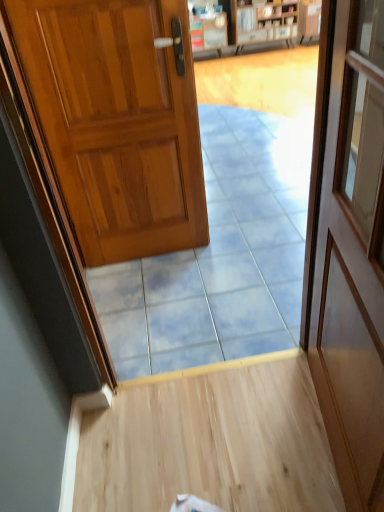
In order to face wooden door at right, which appears as the first door when viewed from the right, should I rotate leftwards or rightwards?

To face it directly, rotate right by 17.883 degrees.

The image size is (384, 512). Describe the element at coordinates (117, 121) in the screenshot. I see `shiny wood door at left, which is the second door in front-to-back order` at that location.

At what (x,y) coordinates should I click in order to perform the action: click on wooden bookshelf at upper center. Please return your answer as a coordinate pair (x, y). Looking at the image, I should click on (252, 25).

Locate an element on the screen. The width and height of the screenshot is (384, 512). blue glossy tile at center is located at coordinates (179, 324).

Which object is closer to the camera, shiny wood door at left, the first door viewed from the left, or wooden bookshelf at upper center?

shiny wood door at left, the first door viewed from the left, is closer to the camera.

From a real-world perspective, which object rests below the other?

wooden bookshelf at upper center, from a real-world perspective.

Considering the positions of objects shiny wood door at left, the first door viewed from the left, and wooden bookshelf at upper center in the image provided, who is more to the right, shiny wood door at left, the first door viewed from the left, or wooden bookshelf at upper center?

wooden bookshelf at upper center is more to the right.

Between shiny wood door at left, the first door viewed from the left, and wooden bookshelf at upper center, which one has larger width?

shiny wood door at left, the first door viewed from the left, is wider.

Is wooden door at right, marked as the 2th door in a back-to-front arrangement, taller than wooden bookshelf at upper center?

Correct, wooden door at right, marked as the 2th door in a back-to-front arrangement, is much taller as wooden bookshelf at upper center.

Considering the sizes of objects wooden door at right, the 2th door viewed from the left, and wooden bookshelf at upper center in the image provided, who is bigger, wooden door at right, the 2th door viewed from the left, or wooden bookshelf at upper center?

wooden bookshelf at upper center is bigger.

Is wooden bookshelf at upper center at the back of wooden door at right, marked as the 2th door in a back-to-front arrangement?

wooden door at right, marked as the 2th door in a back-to-front arrangement, is not turned away from wooden bookshelf at upper center.

Can you confirm if wooden door at right, the 1th door positioned from the front, is positioned to the right of wooden bookshelf at upper center?

Incorrect, wooden door at right, the 1th door positioned from the front, is not on the right side of wooden bookshelf at upper center.

From the image's perspective, between wooden door at right, marked as the 2th door in a back-to-front arrangement, and shiny wood door at left, positioned as the second door in right-to-left order, which one is located above?

From the image's view, shiny wood door at left, positioned as the second door in right-to-left order, is above.

Could you tell me if wooden door at right, the 1th door positioned from the front, is turned towards shiny wood door at left, which is the second door in front-to-back order?

No, wooden door at right, the 1th door positioned from the front, does not turn towards shiny wood door at left, which is the second door in front-to-back order.

Which object is closer to the camera taking this photo, wooden door at right, the 2th door viewed from the left, or shiny wood door at left, which is the second door in front-to-back order?

wooden door at right, the 2th door viewed from the left.

Is blue glossy tile at center surrounding shiny wood door at left, which is the second door in front-to-back order?

No, shiny wood door at left, which is the second door in front-to-back order, is located outside of blue glossy tile at center.

You are a GUI agent. You are given a task and a screenshot of the screen. Output one action in this format:
    pyautogui.click(x=<x>, y=<y>)
    Task: Click on the tile below the shiny wood door at left, the first door viewed from the left (from a real-world perspective)
    The height and width of the screenshot is (512, 384).
    Given the screenshot: What is the action you would take?
    pyautogui.click(x=179, y=324)

In the scene shown: Is blue glossy tile at center bigger or smaller than shiny wood door at left, positioned as the 1th door in back-to-front order?

In the image, blue glossy tile at center appears to be smaller than shiny wood door at left, positioned as the 1th door in back-to-front order.

Would you say wooden bookshelf at upper center is outside shiny wood door at left, positioned as the second door in right-to-left order?

Yes, wooden bookshelf at upper center is located beyond the bounds of shiny wood door at left, positioned as the second door in right-to-left order.

Does point (286, 34) come farther from viewer compared to point (102, 81)?

Yes, it is behind point (102, 81).

Considering the sizes of objects wooden bookshelf at upper center and shiny wood door at left, positioned as the second door in right-to-left order, in the image provided, who is wider, wooden bookshelf at upper center or shiny wood door at left, positioned as the second door in right-to-left order,?

With larger width is shiny wood door at left, positioned as the second door in right-to-left order.

Is wooden bookshelf at upper center to the right of shiny wood door at left, positioned as the second door in right-to-left order, from the viewer's perspective?

Yes, wooden bookshelf at upper center is to the right of shiny wood door at left, positioned as the second door in right-to-left order.

Can you tell me how much blue glossy tile at center and wooden bookshelf at upper center differ in facing direction?

The angular difference between blue glossy tile at center and wooden bookshelf at upper center is 3.7 degrees.

Is point (162, 341) positioned before point (194, 42)?

Yes, it is in front of point (194, 42).

Is blue glossy tile at center not inside wooden bookshelf at upper center?

Absolutely, blue glossy tile at center is external to wooden bookshelf at upper center.

Is the position of blue glossy tile at center more distant than that of wooden bookshelf at upper center?

No, the depth of blue glossy tile at center is less than that of wooden bookshelf at upper center.

Is wooden bookshelf at upper center shorter than wooden door at right, marked as the 2th door in a back-to-front arrangement?

Indeed, wooden bookshelf at upper center has a lesser height compared to wooden door at right, marked as the 2th door in a back-to-front arrangement.

Does wooden bookshelf at upper center have a lesser width compared to wooden door at right, the 2th door viewed from the left?

Incorrect, the width of wooden bookshelf at upper center is not less than that of wooden door at right, the 2th door viewed from the left.

Consider the image. Does wooden bookshelf at upper center lie behind wooden door at right, which appears as the first door when viewed from the right?

Yes, the depth of wooden bookshelf at upper center is greater than that of wooden door at right, which appears as the first door when viewed from the right.

Is wooden bookshelf at upper center smaller than wooden door at right, the 1th door positioned from the front?

Actually, wooden bookshelf at upper center might be larger than wooden door at right, the 1th door positioned from the front.

The width and height of the screenshot is (384, 512). Identify the location of bookshelf above the shiny wood door at left, which is the second door in front-to-back order (from the image's perspective). (252, 25).

Which door is the 2nd one when counting from the front of the wooden bookshelf at upper center? Please provide its 2D coordinates.

[(349, 250)]

Based on their spatial positions, is blue glossy tile at center or shiny wood door at left, positioned as the second door in right-to-left order, further from wooden bookshelf at upper center?

blue glossy tile at center is further to wooden bookshelf at upper center.

Looking at the image, which one is located further to shiny wood door at left, the first door viewed from the left, wooden door at right, the 1th door positioned from the front, or wooden bookshelf at upper center?

wooden bookshelf at upper center is further to shiny wood door at left, the first door viewed from the left.

From the image, which object appears to be farther from blue glossy tile at center, shiny wood door at left, which is the second door in front-to-back order, or wooden door at right, marked as the 2th door in a back-to-front arrangement?

The object further to blue glossy tile at center is wooden door at right, marked as the 2th door in a back-to-front arrangement.

When comparing their distances from wooden bookshelf at upper center, does wooden door at right, marked as the 2th door in a back-to-front arrangement, or shiny wood door at left, the first door viewed from the left, seem closer?

shiny wood door at left, the first door viewed from the left, is closer to wooden bookshelf at upper center.

From the image, which object appears to be nearer to shiny wood door at left, which is the second door in front-to-back order, wooden bookshelf at upper center or blue glossy tile at center?

blue glossy tile at center is positioned closer to the anchor shiny wood door at left, which is the second door in front-to-back order.

When comparing their distances from shiny wood door at left, which is the second door in front-to-back order, does wooden door at right, marked as the 2th door in a back-to-front arrangement, or blue glossy tile at center seem closer?

The object closer to shiny wood door at left, which is the second door in front-to-back order, is blue glossy tile at center.

Based on the photo, estimate the real-world distances between objects in this image. Which object is further from wooden door at right, marked as the 2th door in a back-to-front arrangement, wooden bookshelf at upper center or blue glossy tile at center?

Among the two, wooden bookshelf at upper center is located further to wooden door at right, marked as the 2th door in a back-to-front arrangement.

When comparing their distances from wooden door at right, which appears as the first door when viewed from the right, does wooden bookshelf at upper center or shiny wood door at left, positioned as the second door in right-to-left order, seem further?

wooden bookshelf at upper center lies further to wooden door at right, which appears as the first door when viewed from the right, than the other object.

At what (x,y) coordinates should I click in order to perform the action: click on tile positioned between wooden door at right, marked as the 2th door in a back-to-front arrangement, and wooden bookshelf at upper center from near to far. Please return your answer as a coordinate pair (x, y). Looking at the image, I should click on (179, 324).

At what (x,y) coordinates should I click in order to perform the action: click on door positioned between wooden door at right, the 1th door positioned from the front, and blue glossy tile at center from near to far. Please return your answer as a coordinate pair (x, y). This screenshot has height=512, width=384. Looking at the image, I should click on (117, 121).

Identify the location of tile located between shiny wood door at left, positioned as the 1th door in back-to-front order, and wooden bookshelf at upper center in the depth direction. (179, 324).

Where is `door positioned between wooden door at right, the 2th door viewed from the left, and wooden bookshelf at upper center from near to far`? The height and width of the screenshot is (512, 384). door positioned between wooden door at right, the 2th door viewed from the left, and wooden bookshelf at upper center from near to far is located at coordinates (117, 121).